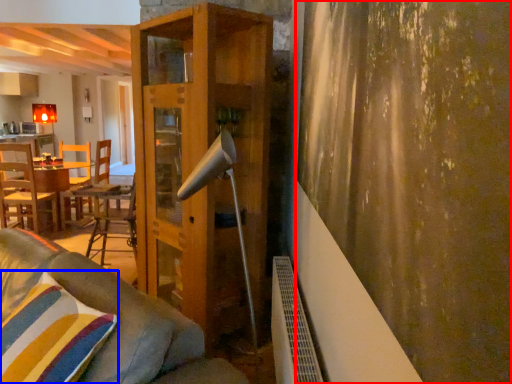
Question: Which of the following is the closest to the observer, curtain (highlighted by a red box) or pillow (highlighted by a blue box)?

Choices:
 (A) curtain
 (B) pillow

Answer: (A)